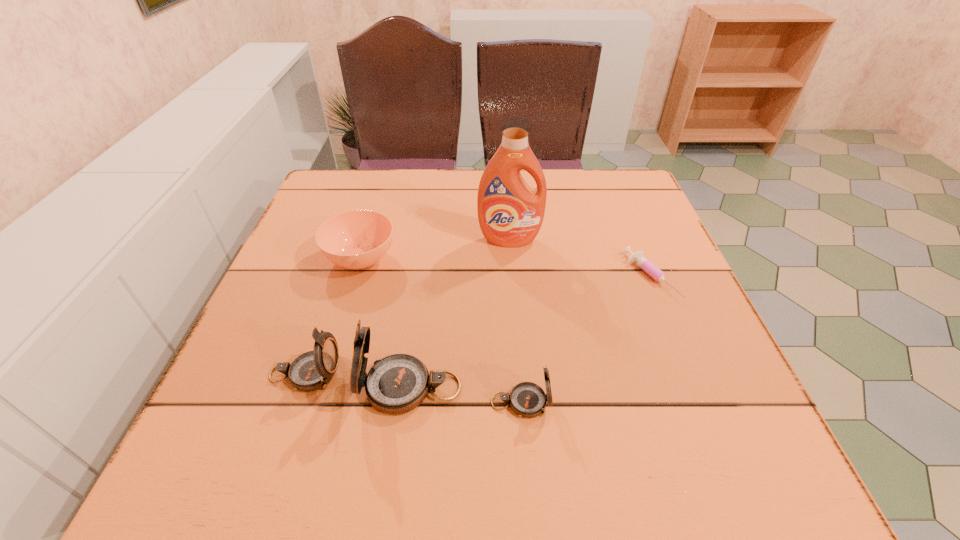
This screenshot has width=960, height=540. I want to click on free spot at the far edge of the desktop, so click(585, 208).

Locate an element on the screen. The image size is (960, 540). vacant area at the near edge is located at coordinates (363, 395).

Identify the location of blank space at the left edge of the desktop. click(x=293, y=277).

Image resolution: width=960 pixels, height=540 pixels. Find the location of `vacant point at the right edge`. vacant point at the right edge is located at coordinates (678, 279).

Image resolution: width=960 pixels, height=540 pixels. In order to click on vacant space at the far right corner of the desktop in this screenshot , I will do `click(608, 212)`.

The height and width of the screenshot is (540, 960). Identify the location of free spot at the near right corner of the desktop. (698, 382).

At what (x,y) coordinates should I click in order to perform the action: click on vacant area between the rightmost object and the soup bowl. Please return your answer as a coordinate pair (x, y). The width and height of the screenshot is (960, 540). Looking at the image, I should click on (506, 268).

What are the coordinates of `vacant space that is in between the rightmost object and the tallest object` in the screenshot? It's located at (580, 258).

Where is `vacant space that is in between the syringe and the tallest object`? The image size is (960, 540). vacant space that is in between the syringe and the tallest object is located at coordinates (580, 258).

Where is `free space that is in between the rightmost object and the third tallest object`? The image size is (960, 540). free space that is in between the rightmost object and the third tallest object is located at coordinates 478,325.